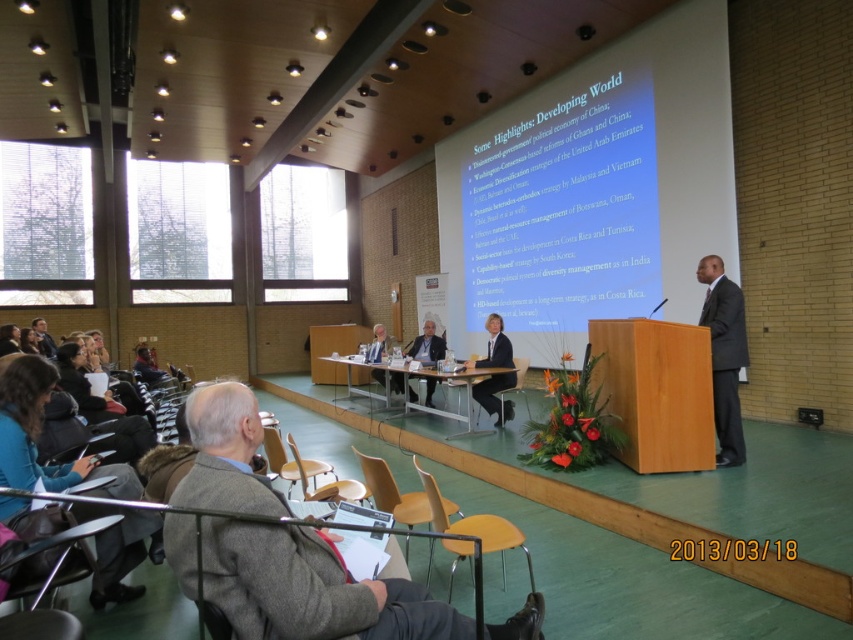
You are an attendee in the conference room. You see the gray woolen jacket at lower left and the yellow wood chair at center. Which object is closer to you from your perspective?

The gray woolen jacket at lower left is closer to you because it is in front of the yellow wood chair at center.

From the picture: You are an event organizer who needs to ensure that all items on stage are properly sized for the event. Based on the image, which item is smaller in size between the yellow wood chair at lower center and the light brown leather jacket at center?

The yellow wood chair at lower center is smaller than the light brown leather jacket at center according to the description.

You are an event organizer checking the setup for the presentation. You notice the gray woolen jacket at lower left and the yellow wood chair at center. Is the jacket placed on the chair or somewhere else?

The gray woolen jacket at lower left is positioned over the yellow wood chair at center, so it is placed on the chair.